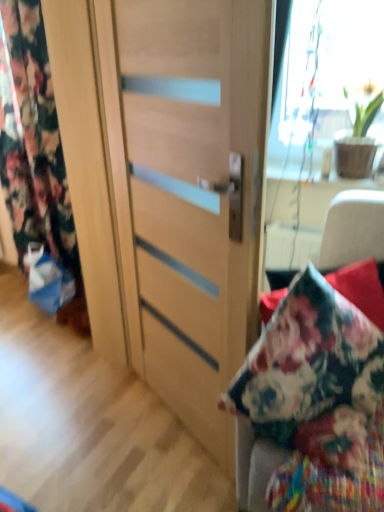
Question: Is floral fabric curtain at left shorter than wooden cabinet at center?

Choices:
 (A) yes
 (B) no

Answer: (B)

Question: Is wooden cabinet at center a part of floral fabric curtain at left?

Choices:
 (A) yes
 (B) no

Answer: (B)

Question: From the image's perspective, is floral fabric curtain at left beneath wooden cabinet at center?

Choices:
 (A) no
 (B) yes

Answer: (A)

Question: Considering the relative sizes of floral fabric curtain at left and wooden cabinet at center in the image provided, is floral fabric curtain at left bigger than wooden cabinet at center?

Choices:
 (A) no
 (B) yes

Answer: (B)

Question: Can we say floral fabric curtain at left lies outside wooden cabinet at center?

Choices:
 (A) no
 (B) yes

Answer: (B)

Question: Considering their positions, is floral fabric curtain at left located in front of or behind green matte plant at upper right?

Choices:
 (A) front
 (B) behind

Answer: (B)

Question: Considering the positions of floral fabric curtain at left and green matte plant at upper right in the image, is floral fabric curtain at left wider or thinner than green matte plant at upper right?

Choices:
 (A) thin
 (B) wide

Answer: (A)

Question: Looking at the image, does floral fabric curtain at left seem bigger or smaller compared to green matte plant at upper right?

Choices:
 (A) big
 (B) small

Answer: (A)

Question: From the image's perspective, is floral fabric curtain at left above or below green matte plant at upper right?

Choices:
 (A) below
 (B) above

Answer: (B)

Question: Is green matte plant at upper right in front of or behind wooden cabinet at center in the image?

Choices:
 (A) front
 (B) behind

Answer: (B)

Question: Do you think green matte plant at upper right is within wooden cabinet at center, or outside of it?

Choices:
 (A) inside
 (B) outside

Answer: (B)

Question: From a real-world perspective, is green matte plant at upper right positioned above or below wooden cabinet at center?

Choices:
 (A) below
 (B) above

Answer: (B)

Question: Considering the positions of point (364, 175) and point (327, 238), is point (364, 175) closer or farther from the camera than point (327, 238)?

Choices:
 (A) closer
 (B) farther

Answer: (B)

Question: Considering the positions of floral fabric curtain at left and matte wood door at center in the image, is floral fabric curtain at left wider or thinner than matte wood door at center?

Choices:
 (A) wide
 (B) thin

Answer: (A)

Question: Considering the positions of floral fabric curtain at left and matte wood door at center in the image, is floral fabric curtain at left taller or shorter than matte wood door at center?

Choices:
 (A) short
 (B) tall

Answer: (B)